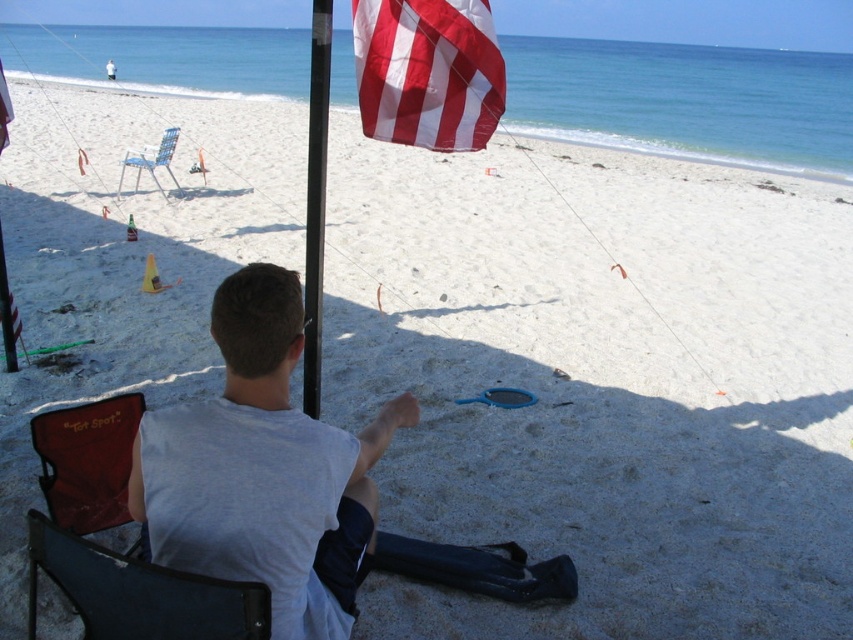
You are a beachgoer who wants to place a large beach umbrella between the maroon fabric chair at lower left and the black matte flag pole at center. Based on their sizes, will the umbrella fit comfortably between them?

The maroon fabric chair at lower left is larger than the black matte flag pole at center. Since the umbrella requires space proportional to the larger object, it should fit comfortably between them as long as the distance between the two objects allows for the umbrella size.